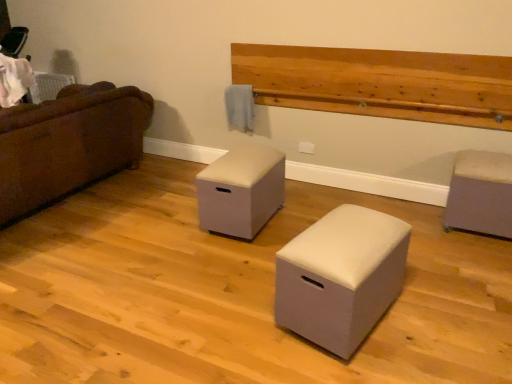
Question: In terms of size, does white fabric ottoman at center, acting as the 2th furniture starting from the left, appear bigger or smaller than beige fabric ottoman at center, which is counted as the 1th furniture, starting from the left?

Choices:
 (A) small
 (B) big

Answer: (B)

Question: From their relative heights in the image, would you say white fabric ottoman at center, acting as the 2th furniture starting from the left, is taller or shorter than beige fabric ottoman at center, which is counted as the 1th furniture, starting from the left?

Choices:
 (A) tall
 (B) short

Answer: (A)

Question: Which object is positioned farthest from the brown fabric couch at left?

Choices:
 (A) beige fabric ottoman at center, which is the 3th furniture from right to left
 (B) white fabric ottoman at center, acting as the 2th furniture starting from the left
 (C) natural wood plank at upper center
 (D) matte gray ottoman at right, the first furniture when ordered from right to left

Answer: (D)

Question: Which of these objects is positioned closest to the white fabric ottoman at center, acting as the 2th furniture starting from the left?

Choices:
 (A) beige fabric ottoman at center, which is the 3th furniture from right to left
 (B) matte gray ottoman at right, which appears as the 3th furniture when viewed from the left
 (C) natural wood plank at upper center
 (D) brown fabric couch at left

Answer: (A)